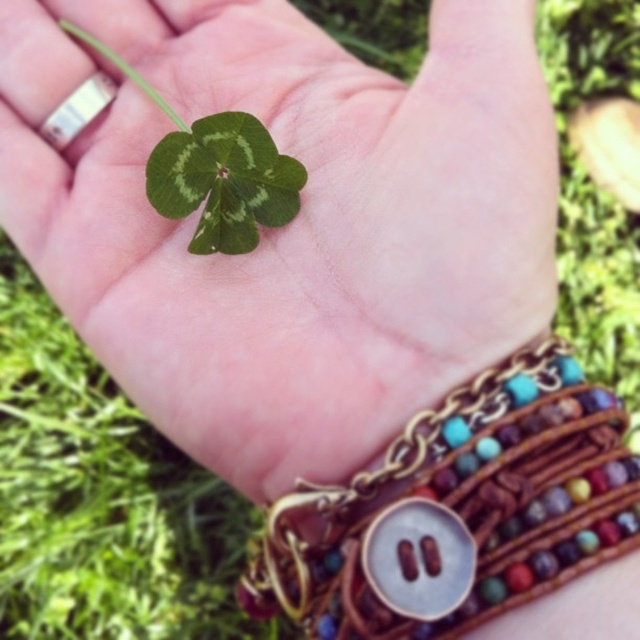
Can you confirm if brown leather bracelet with beads at center is positioned to the right of green matte clover at center?

Correct, you'll find brown leather bracelet with beads at center to the right of green matte clover at center.

Can you confirm if brown leather bracelet with beads at center is smaller than green matte clover at center?

No.

The image size is (640, 640). Find the location of `brown leather bracelet with beads at center`. brown leather bracelet with beads at center is located at coordinates (465, 500).

Does green matte leaf at center have a greater height compared to brown leather bracelet with beads at center?

Indeed, green matte leaf at center has a greater height compared to brown leather bracelet with beads at center.

Who is more forward, (474,269) or (396,468)?

Point (396,468)

You are a GUI agent. You are given a task and a screenshot of the screen. Output one action in this format:
    pyautogui.click(x=<x>, y=<y>)
    Task: Click on the green matte leaf at center
    
    Given the screenshot: What is the action you would take?
    pyautogui.click(x=291, y=224)

Is point (397, 388) farther from viewer compared to point (216, 212)?

No, it is in front of (216, 212).

Which is below, green matte leaf at center or green matte clover at center?

Positioned lower is green matte clover at center.

Does point (16, 29) lie in front of point (220, 250)?

No, (16, 29) is behind (220, 250).

This screenshot has width=640, height=640. In order to click on green matte leaf at center in this screenshot , I will do `click(291, 224)`.